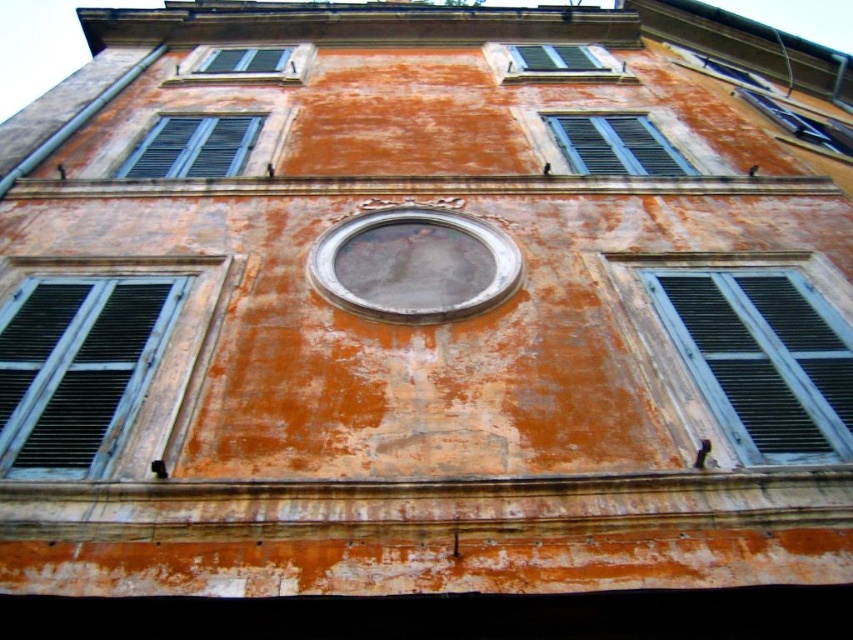
Between matte black shutters at right and green matte shutters at upper center, which one is positioned higher?

Positioned higher is green matte shutters at upper center.

Is point (656, 272) closer to camera compared to point (540, 61)?

Yes.

Locate an element on the screen. Image resolution: width=853 pixels, height=640 pixels. matte black shutters at right is located at coordinates (763, 358).

This screenshot has height=640, width=853. What are the coordinates of `matte black shutters at right` in the screenshot? It's located at (763, 358).

Is matte gray shutters at upper left shorter than green matte shutters at upper center?

In fact, matte gray shutters at upper left may be taller than green matte shutters at upper center.

Who is more distant from viewer, (230, 132) or (605, 67)?

The point (605, 67) is behind.

At what (x,y) coordinates should I click in order to perform the action: click on matte gray shutters at upper left. Please return your answer as a coordinate pair (x, y). This screenshot has width=853, height=640. Looking at the image, I should click on (193, 147).

Between blue matte shutter at left and blue matte window at upper center, which one has more height?

With more height is blue matte shutter at left.

Which is in front, point (18, 461) or point (563, 138)?

Positioned in front is point (18, 461).

Is point (97, 342) less distant than point (567, 156)?

Yes, it is in front of point (567, 156).

You are a GUI agent. You are given a task and a screenshot of the screen. Output one action in this format:
    pyautogui.click(x=<x>, y=<y>)
    Task: Click on the blue matte shutter at left
    The width and height of the screenshot is (853, 640).
    Given the screenshot: What is the action you would take?
    pyautogui.click(x=76, y=369)